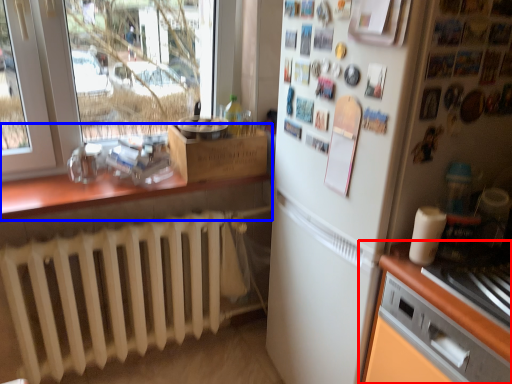
Question: Which point is further to the camera, cabinetry (highlighted by a red box) or countertop (highlighted by a blue box)?

Choices:
 (A) cabinetry
 (B) countertop

Answer: (B)